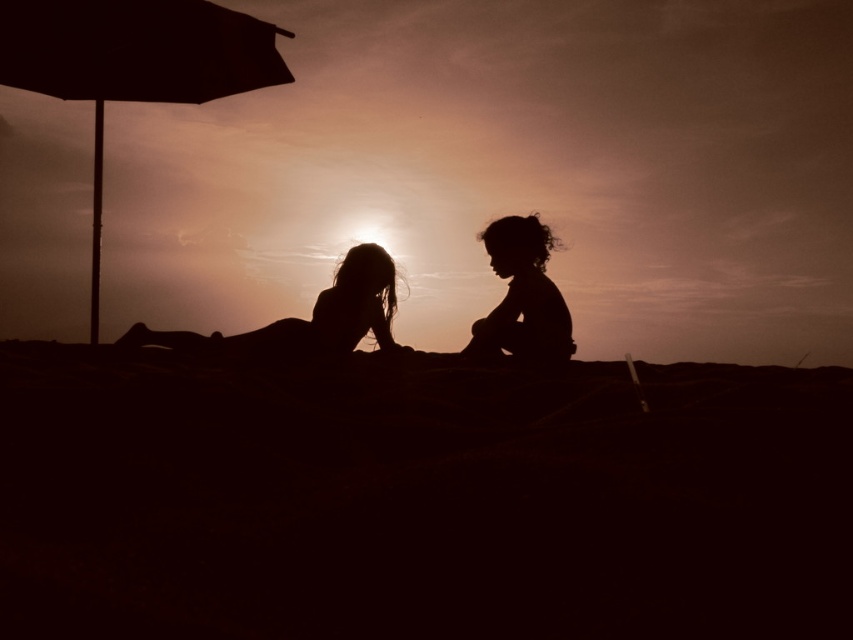
Question: Does silhouette children at center appear under silhouette child at center?

Choices:
 (A) yes
 (B) no

Answer: (A)

Question: In this image, where is matte black umbrella at left located relative to silhouette figure at center?

Choices:
 (A) right
 (B) left

Answer: (B)

Question: Which object appears farthest from the camera in this image?

Choices:
 (A) matte black umbrella at left
 (B) silhouette figure at center
 (C) silhouette children at center
 (D) silhouette child at center

Answer: (D)

Question: Which object appears farthest from the camera in this image?

Choices:
 (A) matte black umbrella at left
 (B) silhouette children at center
 (C) silhouette figure at center
 (D) silhouette child at center

Answer: (D)

Question: Which object is positioned farthest from the silhouette figure at center?

Choices:
 (A) matte black umbrella at left
 (B) silhouette child at center
 (C) silhouette children at center

Answer: (A)

Question: Can you confirm if silhouette figure at center is positioned below silhouette child at center?

Choices:
 (A) yes
 (B) no

Answer: (A)